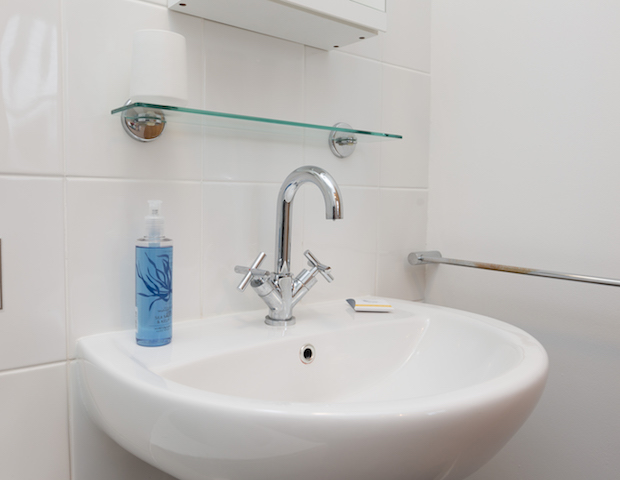
Locate an element on the screen. The image size is (620, 480). right handle of faucet is located at coordinates (317, 267).